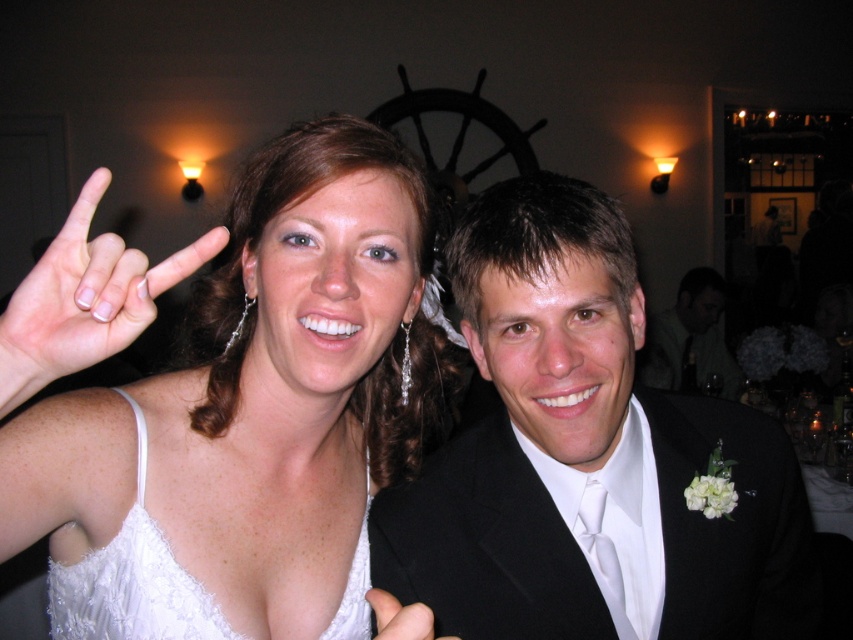
Who is more distant from viewer, (143, 621) or (410, 621)?

Positioned behind is point (143, 621).

Does white lace dress at center appear on the right side of white satin hand at center?

Incorrect, white lace dress at center is not on the right side of white satin hand at center.

What do you see at coordinates (132, 580) in the screenshot? The width and height of the screenshot is (853, 640). I see `white lace dress at center` at bounding box center [132, 580].

What are the coordinates of `white lace dress at center` in the screenshot? It's located at (132, 580).

Does white satin dress at upper left appear over black satin suit at center?

Indeed, white satin dress at upper left is positioned over black satin suit at center.

Between point (206, 296) and point (805, 563), which one is positioned in front?

Point (206, 296) is in front.

Measure the distance between point (x=56, y=506) and camera.

Point (x=56, y=506) is 26.63 inches away from camera.

Where is `white satin dress at upper left`? The height and width of the screenshot is (640, 853). white satin dress at upper left is located at coordinates (227, 403).

Who is more forward, (207, 458) or (50, 374)?

Positioned in front is point (50, 374).

Is point (405, 180) more distant than point (91, 352)?

Yes, point (405, 180) is farther from viewer.

I want to click on white satin dress at upper left, so click(227, 403).